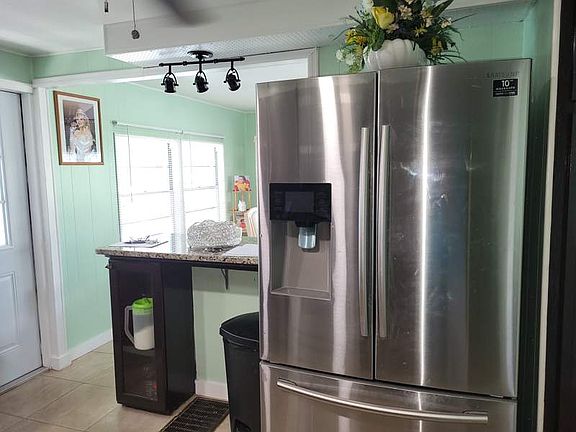
I want to click on pitcher, so click(146, 331).